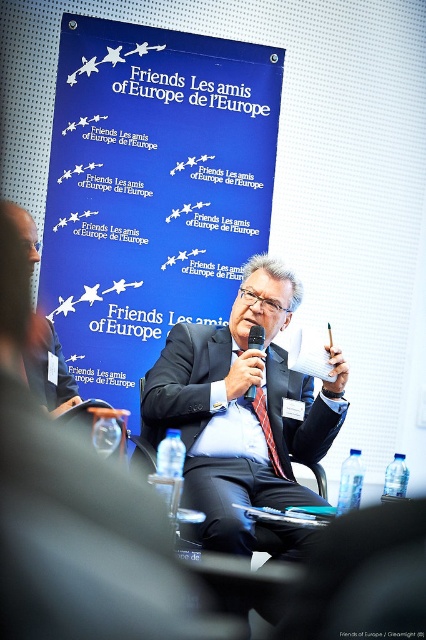
You are attending the event and want to see both the blue paperboard at upper center and the red silk tie at center. Which object is closer to you?

The red silk tie at center is behind the blue paperboard at upper center, so the blue paperboard at upper center is closer to you.

You are attending a formal event with a large blue banner in the background. There is a point at coordinates (x=152, y=189). What object is located at this point?

The blue paperboard at upper center is located at point (x=152, y=189).

You are standing in the conference room and want to walk from point A to point B. Point A is at coordinates point (x=97, y=180) and point B is at coordinates point (x=271, y=433). Which point is closer to you when you start walking?

Point A is closer to you because it is further to the viewer than point B, so you can reach it sooner.